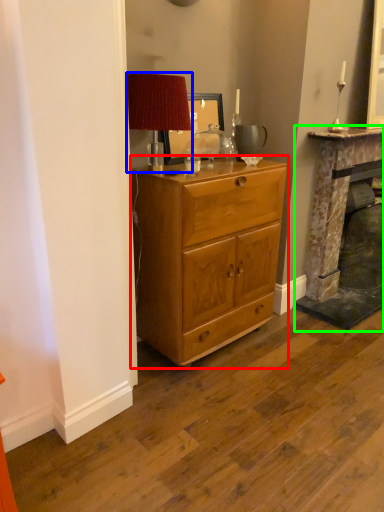
Question: Considering the real-world distances, which object is farthest from chest of drawers (highlighted by a red box)? table lamp (highlighted by a blue box) or fireplace (highlighted by a green box)?

Choices:
 (A) table lamp
 (B) fireplace

Answer: (B)